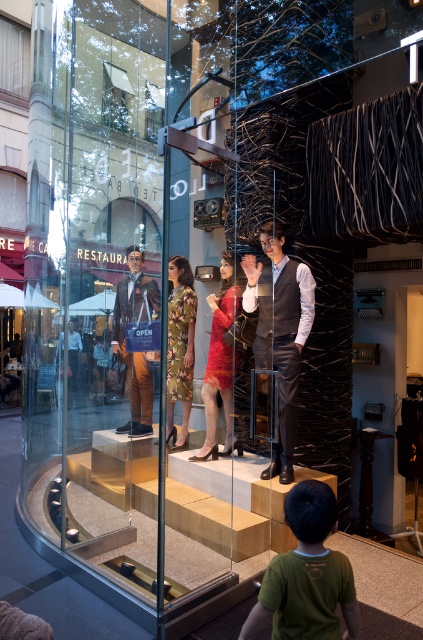
This screenshot has width=423, height=640. What do you see at coordinates (307, 573) in the screenshot?
I see `green t-shirt at lower center` at bounding box center [307, 573].

Is green t-shirt at lower center smaller than matte brown suit at center?

Yes.

Is point (296, 508) farther from camera compared to point (147, 298)?

No, it is in front of (147, 298).

In order to click on green t-shirt at lower center in this screenshot , I will do `click(307, 573)`.

Does green t-shirt at lower center appear on the left side of matte black vest at center?

Correct, you'll find green t-shirt at lower center to the left of matte black vest at center.

Is point (280, 566) positioned after point (260, 243)?

No, (280, 566) is closer to viewer.

Find the location of a particular element. green t-shirt at lower center is located at coordinates (307, 573).

Between matte black vest at center and matte brown suit at center, which one has more height?

With more height is matte black vest at center.

Is matte black vest at center to the left of matte brown suit at center from the viewer's perspective?

Incorrect, matte black vest at center is not on the left side of matte brown suit at center.

Locate an element on the screen. This screenshot has width=423, height=640. matte black vest at center is located at coordinates (280, 332).

Locate an element on the screen. The height and width of the screenshot is (640, 423). matte black vest at center is located at coordinates (280, 332).